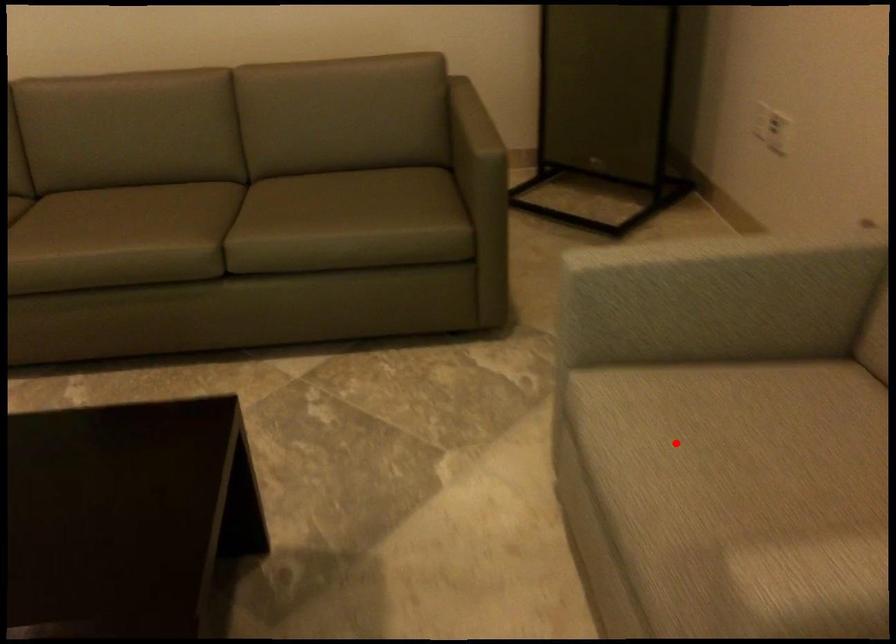
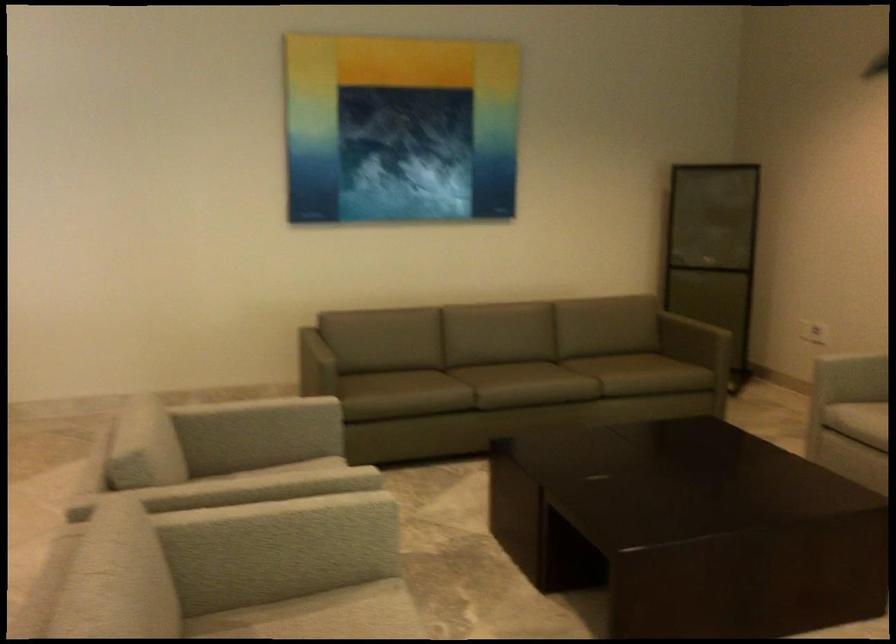
Question: I am providing you with two images of the same scene from different viewpoints. A red point is shown in image1. For the corresponding object point in image2, is it positioned nearer or farther from the camera?

Choices:
 (A) Nearer
 (B) Farther

Answer: (B)